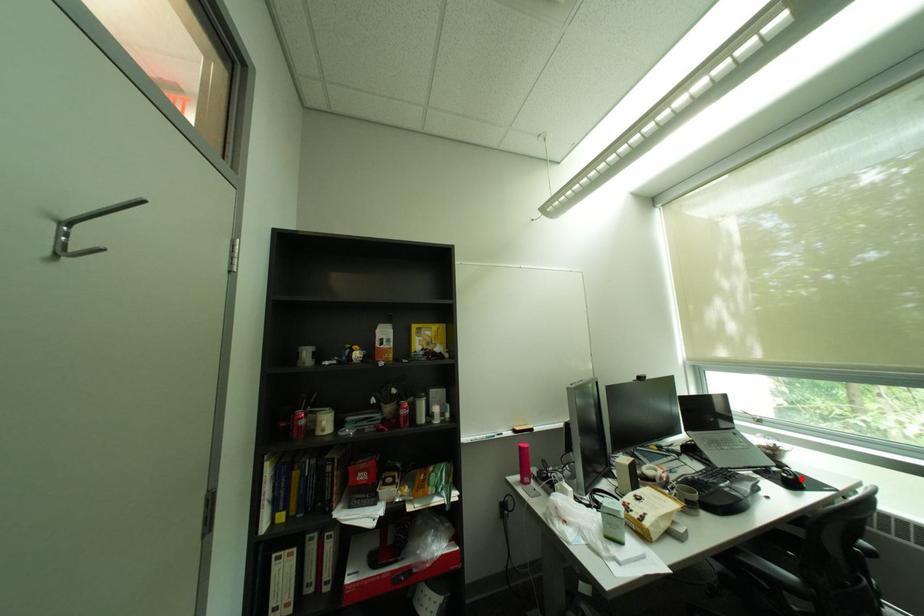
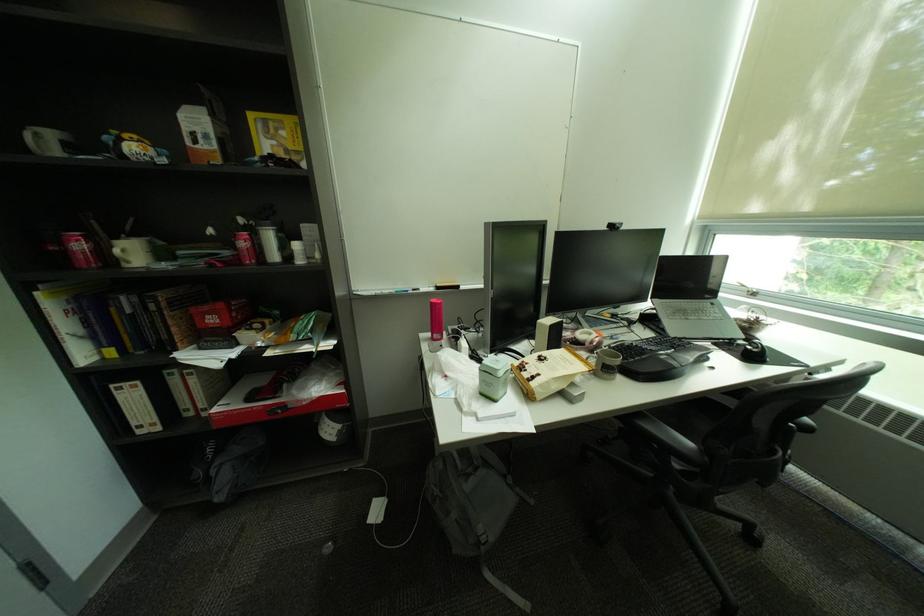
In the second image, find the point that corresponds to the highlighted location in the first image.

(766, 352)